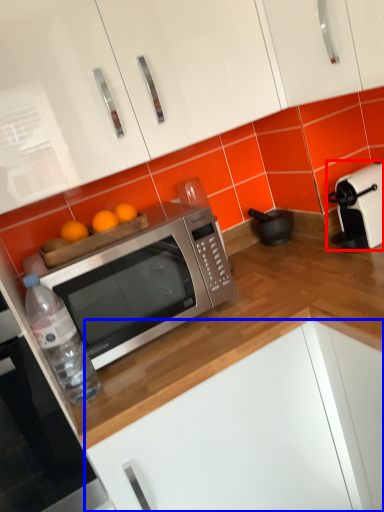
Question: Which object is closer to the camera taking this photo, toaster (highlighted by a red box) or cabinetry (highlighted by a blue box)?

Choices:
 (A) toaster
 (B) cabinetry

Answer: (B)